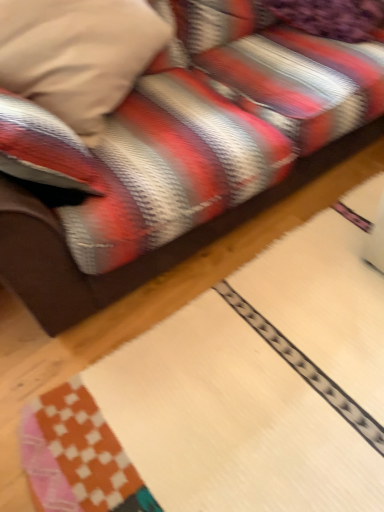
This screenshot has width=384, height=512. What do you see at coordinates (331, 17) in the screenshot?
I see `velvet purple pillow at upper right, which is the second pillow from left to right` at bounding box center [331, 17].

Identify the location of velvet purple pillow at upper right, which is the second pillow from left to right. (331, 17).

Measure the distance between point (317, 32) and camera.

Point (317, 32) is 1.59 meters from camera.

In order to face velvety beige pillow at upper left, the first pillow positioned from the left, should I rotate leftwards or rightwards?

You should look left and rotate roughly 16.590 degrees.

What do you see at coordinates (78, 55) in the screenshot?
I see `velvety beige pillow at upper left, which appears as the second pillow when viewed from the right` at bounding box center [78, 55].

Where is `velvety beige pillow at upper left, which appears as the second pillow when viewed from the right`? velvety beige pillow at upper left, which appears as the second pillow when viewed from the right is located at coordinates (78, 55).

Image resolution: width=384 pixels, height=512 pixels. Find the location of `velvet purple pillow at upper right, positioned as the first pillow in right-to-left order`. velvet purple pillow at upper right, positioned as the first pillow in right-to-left order is located at coordinates (331, 17).

Does velvety beige pillow at upper left, which appears as the second pillow when viewed from the right, appear on the left side of velvet purple pillow at upper right, positioned as the first pillow in right-to-left order?

Yes, velvety beige pillow at upper left, which appears as the second pillow when viewed from the right, is to the left of velvet purple pillow at upper right, positioned as the first pillow in right-to-left order.

Consider the image. Is velvety beige pillow at upper left, which appears as the second pillow when viewed from the right, behind velvet purple pillow at upper right, which is the second pillow from left to right?

No, velvety beige pillow at upper left, which appears as the second pillow when viewed from the right, is closer to the camera.

Considering the positions of points (88, 51) and (290, 6), is point (88, 51) closer to camera compared to point (290, 6)?

Yes, point (88, 51) is closer to viewer.

From the image's perspective, is velvety beige pillow at upper left, which appears as the second pillow when viewed from the right, below velvet purple pillow at upper right, which is the second pillow from left to right?

Indeed, from the image's perspective, velvety beige pillow at upper left, which appears as the second pillow when viewed from the right, is shown beneath velvet purple pillow at upper right, which is the second pillow from left to right.

From a real-world perspective, is velvety beige pillow at upper left, the first pillow positioned from the left, positioned over velvet purple pillow at upper right, which is the second pillow from left to right, based on gravity?

Indeed, from a real-world perspective, velvety beige pillow at upper left, the first pillow positioned from the left, stands above velvet purple pillow at upper right, which is the second pillow from left to right.

Considering the relative sizes of velvety beige pillow at upper left, which appears as the second pillow when viewed from the right, and velvet purple pillow at upper right, which is the second pillow from left to right, in the image provided, is velvety beige pillow at upper left, which appears as the second pillow when viewed from the right, thinner than velvet purple pillow at upper right, which is the second pillow from left to right,?

No.

Considering the relative sizes of velvety beige pillow at upper left, the first pillow positioned from the left, and velvet purple pillow at upper right, positioned as the first pillow in right-to-left order, in the image provided, is velvety beige pillow at upper left, the first pillow positioned from the left, shorter than velvet purple pillow at upper right, positioned as the first pillow in right-to-left order,?

No, velvety beige pillow at upper left, the first pillow positioned from the left, is not shorter than velvet purple pillow at upper right, positioned as the first pillow in right-to-left order.

Looking at the image, does velvety beige pillow at upper left, which appears as the second pillow when viewed from the right, seem bigger or smaller compared to velvet purple pillow at upper right, which is the second pillow from left to right?

Considering their sizes, velvety beige pillow at upper left, which appears as the second pillow when viewed from the right, takes up more space than velvet purple pillow at upper right, which is the second pillow from left to right.

Is velvety beige pillow at upper left, which appears as the second pillow when viewed from the right, not inside velvet purple pillow at upper right, positioned as the first pillow in right-to-left order?

Indeed, velvety beige pillow at upper left, which appears as the second pillow when viewed from the right, is completely outside velvet purple pillow at upper right, positioned as the first pillow in right-to-left order.

Is velvety beige pillow at upper left, the first pillow positioned from the left, positioned far away from velvet purple pillow at upper right, positioned as the first pillow in right-to-left order?

No, velvety beige pillow at upper left, the first pillow positioned from the left, is not far away from velvet purple pillow at upper right, positioned as the first pillow in right-to-left order.

Is velvety beige pillow at upper left, the first pillow positioned from the left, aimed at velvet purple pillow at upper right, positioned as the first pillow in right-to-left order?

No, velvety beige pillow at upper left, the first pillow positioned from the left, does not turn towards velvet purple pillow at upper right, positioned as the first pillow in right-to-left order.

At what (x,y) coordinates should I click in order to perform the action: click on pillow below the velvet purple pillow at upper right, which is the second pillow from left to right (from the image's perspective). Please return your answer as a coordinate pair (x, y). The height and width of the screenshot is (512, 384). Looking at the image, I should click on (78, 55).

Can you confirm if velvet purple pillow at upper right, which is the second pillow from left to right, is positioned to the right of velvety beige pillow at upper left, which appears as the second pillow when viewed from the right?

Indeed, velvet purple pillow at upper right, which is the second pillow from left to right, is positioned on the right side of velvety beige pillow at upper left, which appears as the second pillow when viewed from the right.

Relative to velvety beige pillow at upper left, the first pillow positioned from the left, is velvet purple pillow at upper right, which is the second pillow from left to right, in front or behind?

Visually, velvet purple pillow at upper right, which is the second pillow from left to right, is located behind velvety beige pillow at upper left, the first pillow positioned from the left.

Is point (341, 12) farther from viewer compared to point (27, 97)?

That is True.

From the image's perspective, which object appears higher, velvet purple pillow at upper right, which is the second pillow from left to right, or velvety beige pillow at upper left, the first pillow positioned from the left?

velvet purple pillow at upper right, which is the second pillow from left to right, from the image's perspective.

From a real-world perspective, between velvet purple pillow at upper right, which is the second pillow from left to right, and velvety beige pillow at upper left, the first pillow positioned from the left, who is vertically higher?

From a 3D spatial view, velvety beige pillow at upper left, the first pillow positioned from the left, is above.

Can you confirm if velvet purple pillow at upper right, positioned as the first pillow in right-to-left order, is wider than velvety beige pillow at upper left, which appears as the second pillow when viewed from the right?

In fact, velvet purple pillow at upper right, positioned as the first pillow in right-to-left order, might be narrower than velvety beige pillow at upper left, which appears as the second pillow when viewed from the right.

Considering the sizes of velvet purple pillow at upper right, positioned as the first pillow in right-to-left order, and velvety beige pillow at upper left, which appears as the second pillow when viewed from the right, in the image, is velvet purple pillow at upper right, positioned as the first pillow in right-to-left order, taller or shorter than velvety beige pillow at upper left, which appears as the second pillow when viewed from the right,?

velvet purple pillow at upper right, positioned as the first pillow in right-to-left order, is shorter than velvety beige pillow at upper left, which appears as the second pillow when viewed from the right.

Based on their sizes in the image, would you say velvet purple pillow at upper right, positioned as the first pillow in right-to-left order, is bigger or smaller than velvety beige pillow at upper left, which appears as the second pillow when viewed from the right?

velvet purple pillow at upper right, positioned as the first pillow in right-to-left order, is smaller than velvety beige pillow at upper left, which appears as the second pillow when viewed from the right.

Is velvet purple pillow at upper right, which is the second pillow from left to right, outside of velvety beige pillow at upper left, which appears as the second pillow when viewed from the right?

Indeed, velvet purple pillow at upper right, which is the second pillow from left to right, is completely outside velvety beige pillow at upper left, which appears as the second pillow when viewed from the right.

Is velvet purple pillow at upper right, positioned as the first pillow in right-to-left order, positioned far away from velvety beige pillow at upper left, the first pillow positioned from the left?

velvet purple pillow at upper right, positioned as the first pillow in right-to-left order, is near velvety beige pillow at upper left, the first pillow positioned from the left, not far away.

Could you tell me if velvet purple pillow at upper right, which is the second pillow from left to right, is facing velvety beige pillow at upper left, which appears as the second pillow when viewed from the right?

No, velvet purple pillow at upper right, which is the second pillow from left to right, is not turned towards velvety beige pillow at upper left, which appears as the second pillow when viewed from the right.

In the scene shown: How many degrees apart are the facing directions of velvet purple pillow at upper right, positioned as the first pillow in right-to-left order, and velvety beige pillow at upper left, which appears as the second pillow when viewed from the right?

They differ by 20.7 degrees in their facing directions.

How much distance is there between velvet purple pillow at upper right, which is the second pillow from left to right, and velvety beige pillow at upper left, the first pillow positioned from the left?

velvet purple pillow at upper right, which is the second pillow from left to right, is 79.02 centimeters from velvety beige pillow at upper left, the first pillow positioned from the left.

Where is `pillow above the velvet purple pillow at upper right, positioned as the first pillow in right-to-left order (from a real-world perspective)`? pillow above the velvet purple pillow at upper right, positioned as the first pillow in right-to-left order (from a real-world perspective) is located at coordinates (78, 55).

At what (x,y) coordinates should I click in order to perform the action: click on pillow behind the velvety beige pillow at upper left, which appears as the second pillow when viewed from the right. Please return your answer as a coordinate pair (x, y). This screenshot has width=384, height=512. Looking at the image, I should click on (331, 17).

Where is `pillow on the right of velvety beige pillow at upper left, the first pillow positioned from the left`? Image resolution: width=384 pixels, height=512 pixels. pillow on the right of velvety beige pillow at upper left, the first pillow positioned from the left is located at coordinates (331, 17).